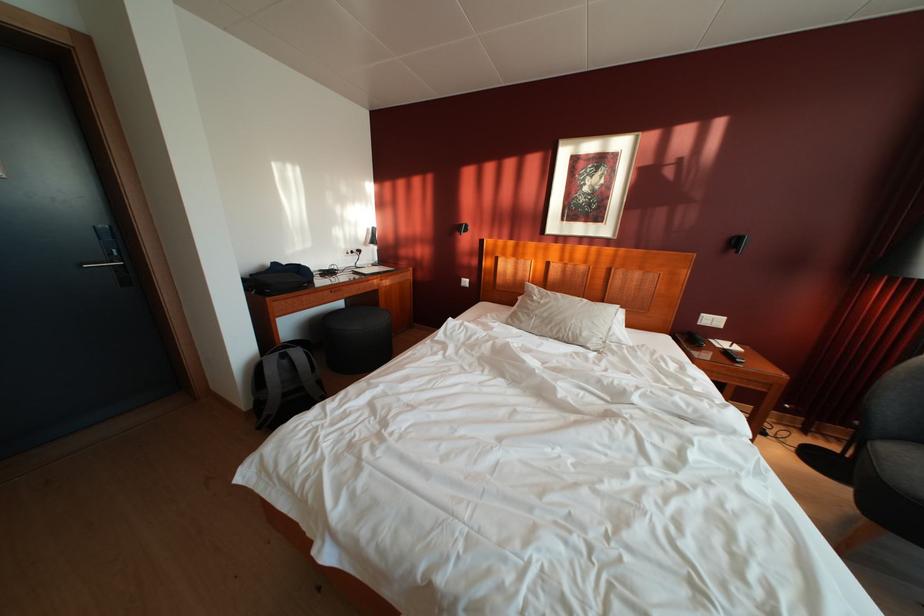
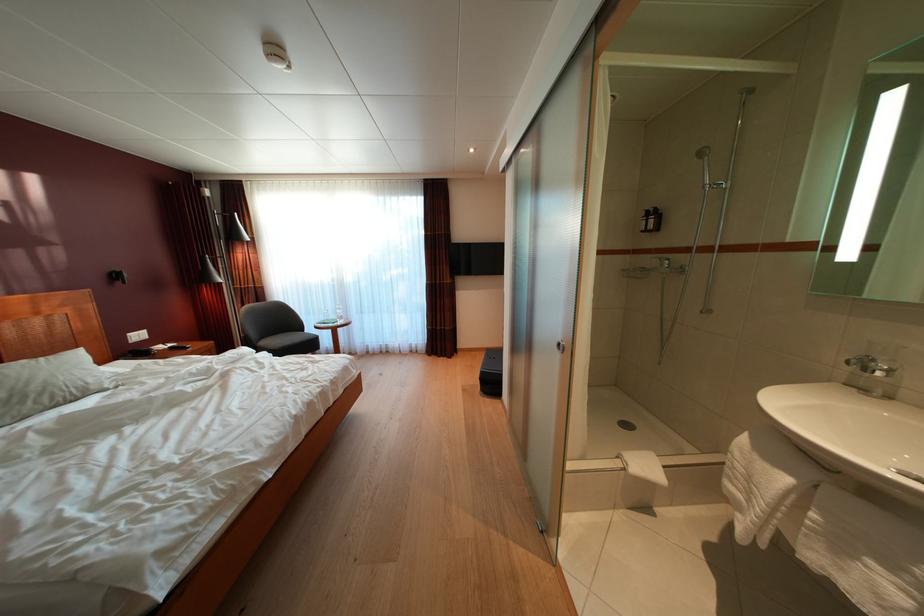
Locate, in the second image, the point that corresponds to (553,321) in the first image.

(10, 400)